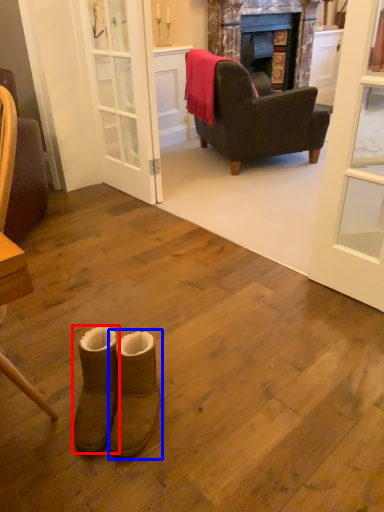
Question: Which object is closer to the camera taking this photo, footwear (highlighted by a red box) or footwear (highlighted by a blue box)?

Choices:
 (A) footwear
 (B) footwear

Answer: (B)